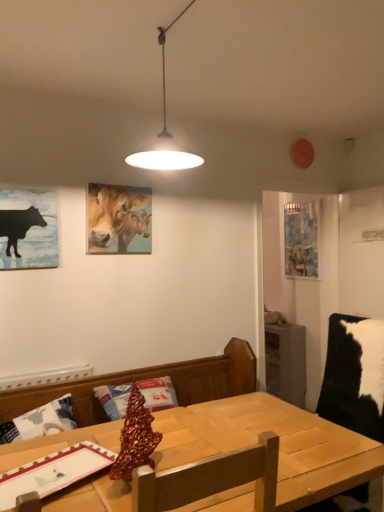
Question: Visually, is wooden table at center positioned to the left or to the right of wooden table at center?

Choices:
 (A) right
 (B) left

Answer: (A)

Question: Is wooden table at center bigger or smaller than wooden table at center?

Choices:
 (A) big
 (B) small

Answer: (A)

Question: Based on their relative distances, which object is farther from the black paper at left, which ranks as the third picture frame in right-to-left order?

Choices:
 (A) blue fabric picture frame at right, the 3th picture frame from the front
 (B) wooden table at center
 (C) oil painting of cows at upper center, the 2th picture frame in the back-to-front sequence
 (D) wooden table at center

Answer: (A)

Question: Which object is the closest to the blue fabric picture frame at right, positioned as the first picture frame in right-to-left order?

Choices:
 (A) oil painting of cows at upper center, the 2th picture frame in the back-to-front sequence
 (B) black paper at left, the third picture frame positioned from the back
 (C) wooden table at center
 (D) wooden table at center

Answer: (C)